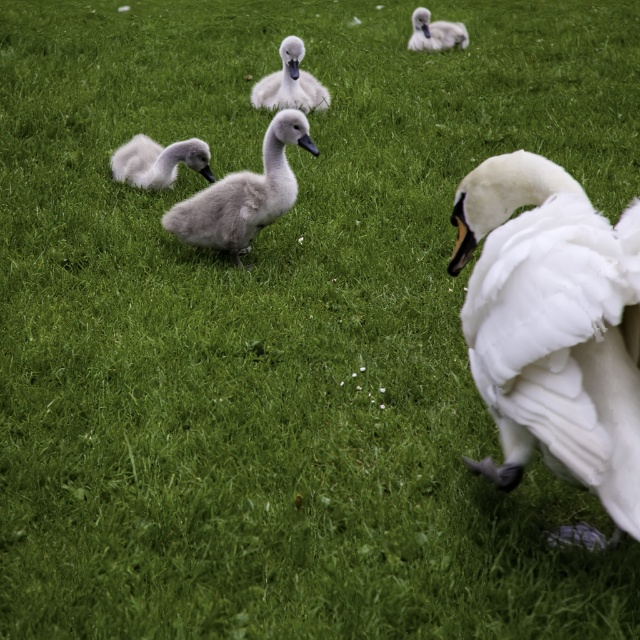
Question: Which of the following is the farthest from the observer?

Choices:
 (A) black glossy beak at center
 (B) gray matte beak at center

Answer: (B)

Question: Does white fluffy swan at upper center lie in front of black glossy beak at center?

Choices:
 (A) yes
 (B) no

Answer: (B)

Question: Among these objects, which one is nearest to the camera?

Choices:
 (A) gray downy cygnet at center
 (B) soft gray swan at upper center
 (C) black glossy beak at center
 (D) white fluffy swan at center

Answer: (D)

Question: Which object appears closest to the camera in this image?

Choices:
 (A) white fluffy swan at center
 (B) gray matte beak at center

Answer: (A)

Question: Does white fluffy swan at upper center appear under soft gray swan at upper center?

Choices:
 (A) yes
 (B) no

Answer: (A)

Question: Is white fluffy swan at center wider than black glossy beak at center?

Choices:
 (A) no
 (B) yes

Answer: (B)